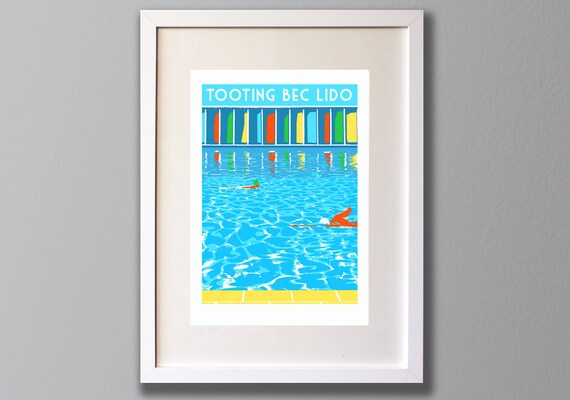
This screenshot has height=400, width=570. In order to click on floor in this screenshot , I will do `click(274, 300)`.